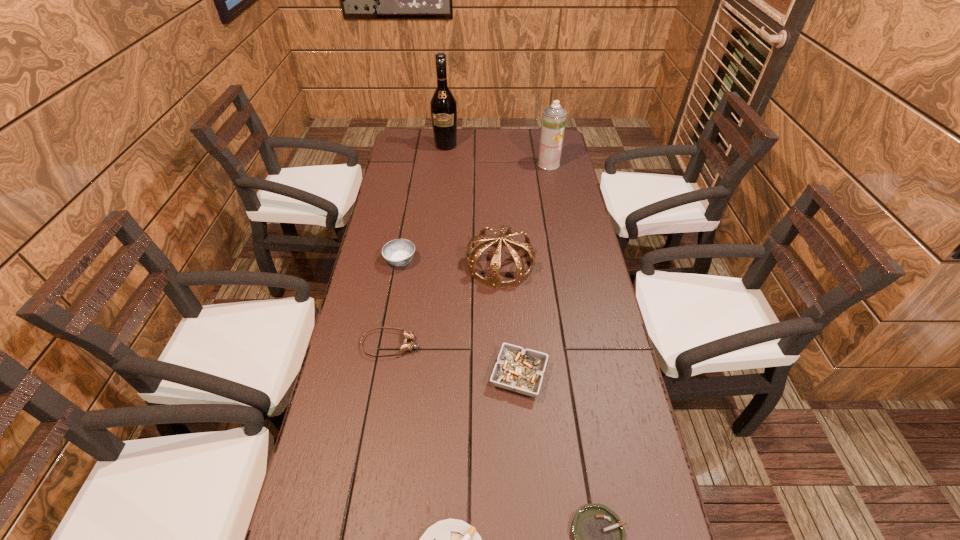
Identify the location of free region located 0.210m on the front of the second farthest object. This screenshot has width=960, height=540. (556, 201).

Where is `vacant space located 0.210m on the front of the tiara`? vacant space located 0.210m on the front of the tiara is located at coordinates (504, 347).

Where is `vacant region located 0.400m on the right of the tallest ashtray`? The image size is (960, 540). vacant region located 0.400m on the right of the tallest ashtray is located at coordinates point(540,260).

The image size is (960, 540). In order to click on free region located 0.290m on the front of the second ashtray from right to left in this screenshot , I will do `click(530, 536)`.

Where is `vacant region located 0.350m on the front lenses and sides of the goggles`? This screenshot has height=540, width=960. vacant region located 0.350m on the front lenses and sides of the goggles is located at coordinates (550, 345).

Identify the location of object situated at the far edge. The height and width of the screenshot is (540, 960). (443, 105).

Find the location of a particular element. This screenshot has height=540, width=960. ashtray at the left edge is located at coordinates (399, 252).

Identify the location of goggles that is at the left edge. The image size is (960, 540). (406, 346).

You are a GUI agent. You are given a task and a screenshot of the screen. Output one action in this format:
    pyautogui.click(x=<x>, y=<y>)
    Task: Click on the object that is positioned at the right edge
    The width and height of the screenshot is (960, 540).
    Given the screenshot: What is the action you would take?
    pyautogui.click(x=554, y=117)

Image resolution: width=960 pixels, height=540 pixels. What are the coordinates of `vacant space at the far edge of the desktop` in the screenshot? It's located at (468, 154).